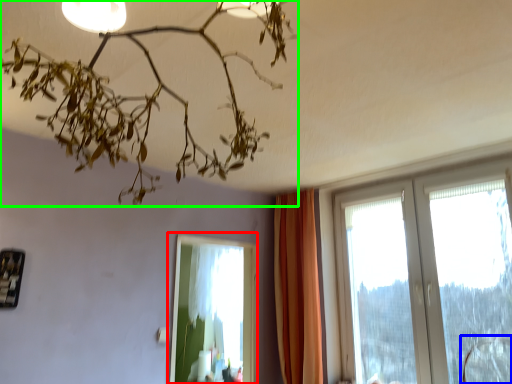
Question: Which is nearer to the bay window (highlighted by a red box)? swivel chair (highlighted by a blue box) or lamp (highlighted by a green box).

Choices:
 (A) swivel chair
 (B) lamp

Answer: (A)